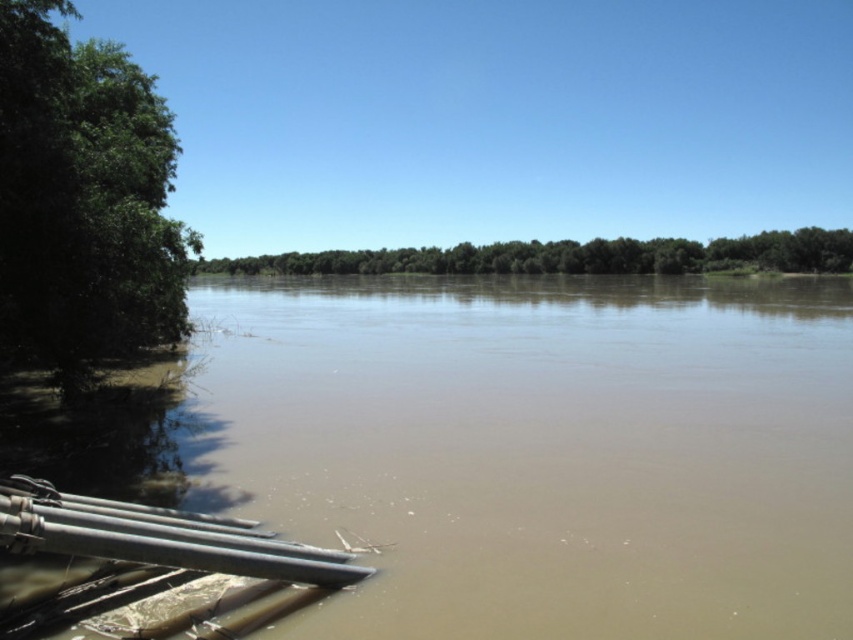
Consider the image. You are a hiker who wants to cross the river using a bridge that is exactly 25 meters long. You see the brown muddy water at lower left and the green leafy tree at left. Can you safely cross the river using this bridge?

The brown muddy water at lower left is 25.45 meters away from the green leafy tree at left. Since the bridge is exactly 25 meters long, it is 0.45 meters shorter than the required distance. Therefore, the bridge would not span the entire river, making it unsafe to cross.

You are a construction worker inspecting the riverside area. You notice the brown muddy water at lower left and the matte gray water pipe at lower left. Which object is closer to you as you stand at the riverside?

The brown muddy water at lower left is closer to you because the matte gray water pipe at lower left is positioned behind it.